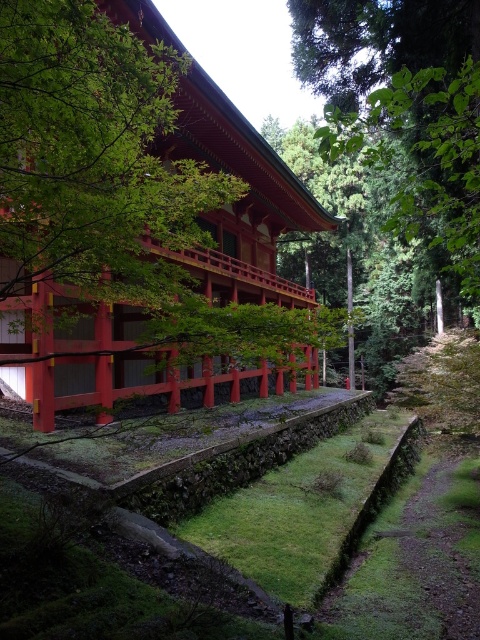
You are standing on the pathway leading to the temple and notice two green leafy trees. One is labeled as the green leafy tree at center and the other as the green leafy tree at upper center. Which tree is positioned higher in the image?

The green leafy tree at upper center is positioned higher in the image than the green leafy tree at center.

You are standing at the entrance of the temple and see two green leafy trees in the scene. Which tree is closer to you, the green leafy tree at center or the green leafy tree at upper center?

The green leafy tree at center is closer to you because it is positioned further to the viewer than the green leafy tree at upper center.